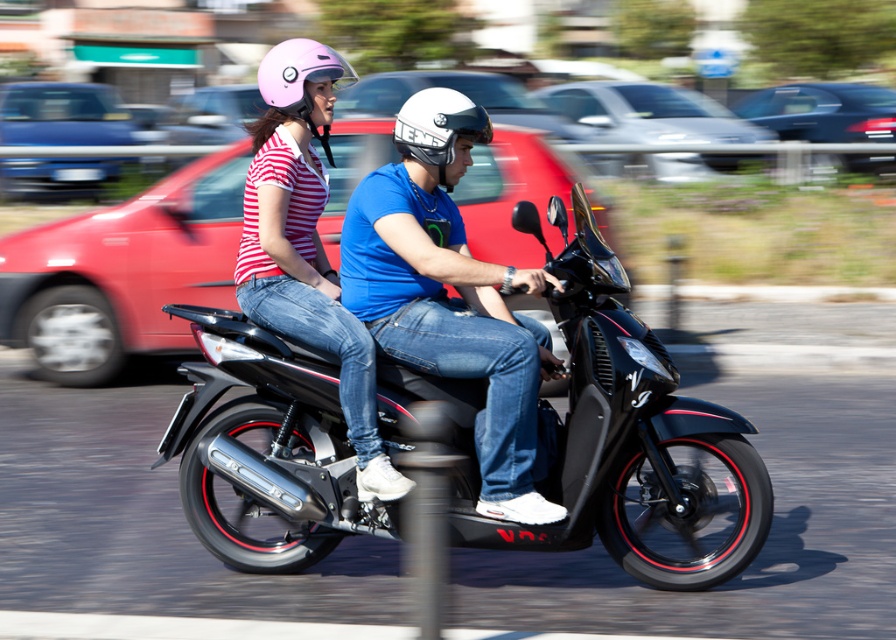
You are a delivery person on a scooter. You need to pass through a narrow alley that is 20 inches wide. The alley has two scooters parked side by side. One is a black matte scooter at center and the other is a shiny black scooter at center. Can you safely pass through the alley with your scooter?

The distance between the black matte scooter at center and the shiny black scooter at center is 18.31 inches. Since the alley is 20 inches wide, there is 1.69 inches of space remaining. This narrow gap may make it difficult, but it is technically possible to pass through with caution.

You are a pedestrian standing on the sidewalk. You see the shiny black scooter at center and the pink matte helmet at upper center. Which object is closer to you?

The shiny black scooter at center is closer to you because it is positioned in front of the pink matte helmet at upper center.